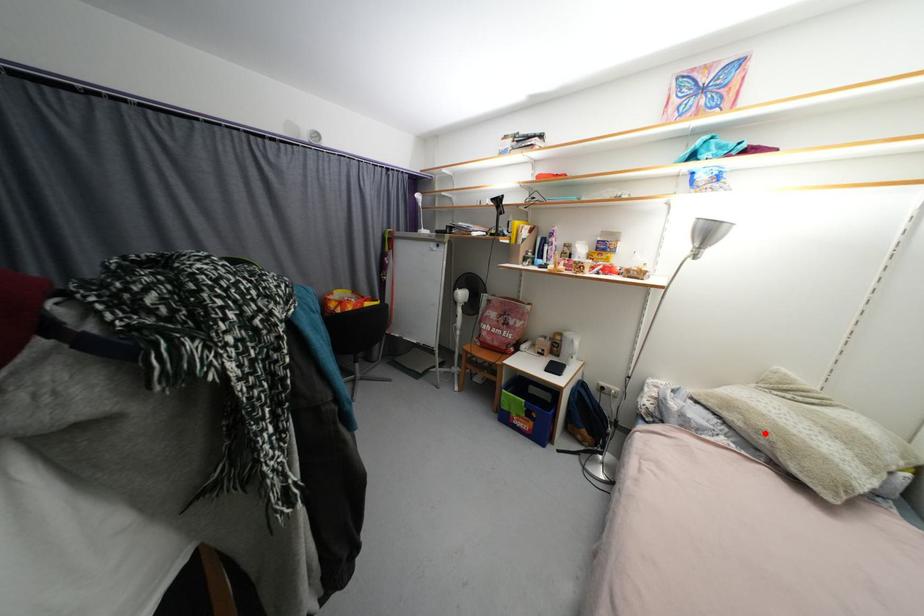
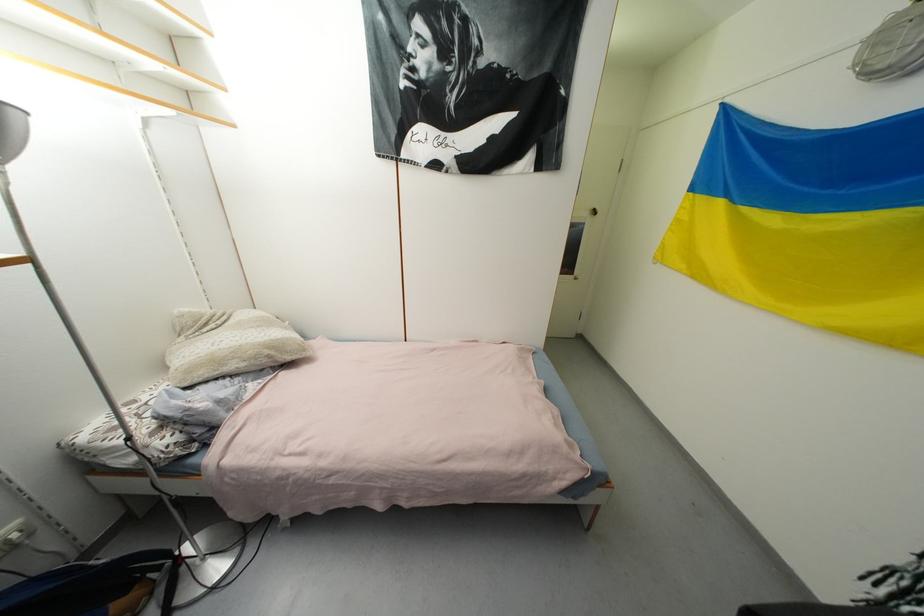
Question: A red point is marked in image1. In image2, is the corresponding 3D point closer to the camera or farther? Reply with the corresponding letter.

Choices:
 (A) The corresponding 3D point is closer.
 (B) The corresponding 3D point is farther.

Answer: (A)